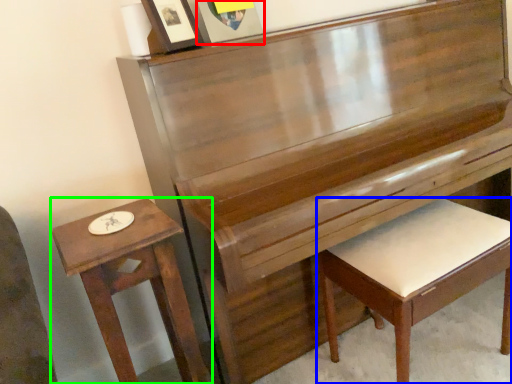
Question: Considering the real-world distances, which object is closest to picture frame (highlighted by a red box)? furniture (highlighted by a blue box) or table (highlighted by a green box).

Choices:
 (A) furniture
 (B) table

Answer: (B)